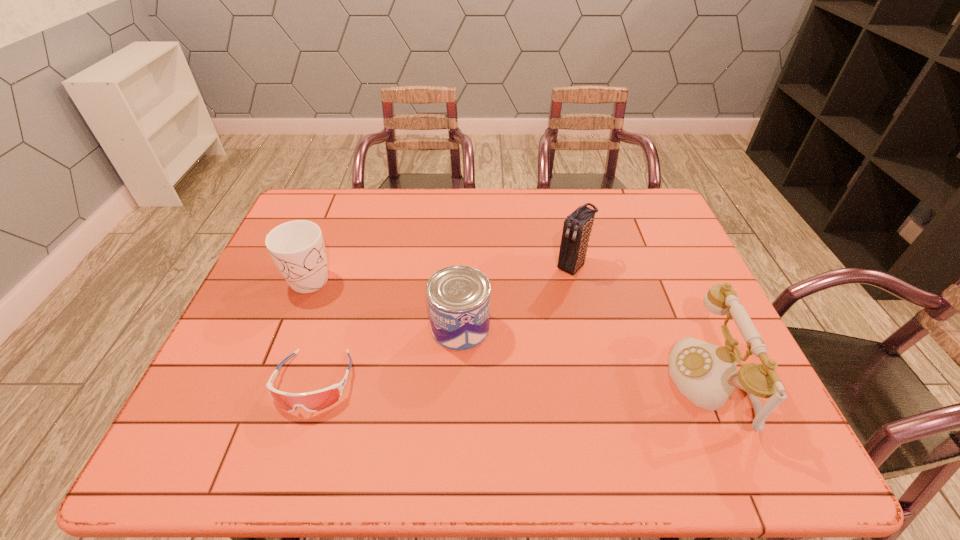
Where is `goggles`? The height and width of the screenshot is (540, 960). goggles is located at coordinates (314, 401).

At what (x,y) coordinates should I click in order to perform the action: click on the rightmost object. Please return your answer as a coordinate pair (x, y). The image size is (960, 540). Looking at the image, I should click on (706, 374).

Locate an element on the screen. mug is located at coordinates (297, 248).

Image resolution: width=960 pixels, height=540 pixels. I want to click on the third object from right to left, so click(458, 297).

Find the location of `clutch bag`. clutch bag is located at coordinates (577, 227).

At what (x,y) coordinates should I click in order to perform the action: click on vacant space positioned 0.210m on the dial of the rightmost object. Please return your answer as a coordinate pair (x, y). Looking at the image, I should click on (580, 382).

Identify the location of vacant space located on the dial of the rightmost object. click(x=549, y=382).

At what (x,y) coordinates should I click in order to perform the action: click on free space located on the dial of the rightmost object. Please return your answer as a coordinate pair (x, y). Looking at the image, I should click on (523, 382).

Where is `vacant space located on the side of the mug with the handle`? The image size is (960, 540). vacant space located on the side of the mug with the handle is located at coordinates (351, 302).

Find the location of a particular element. The width and height of the screenshot is (960, 540). free location located on the side of the mug with the handle is located at coordinates (383, 319).